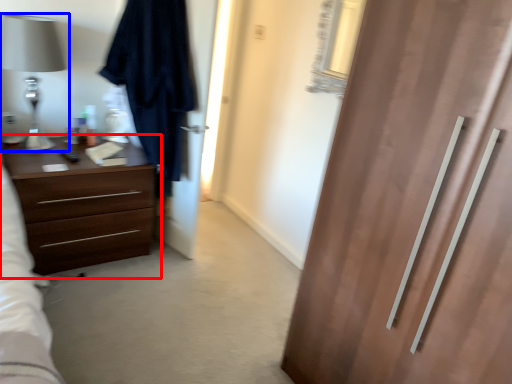
Question: Which of the following is the farthest to the observer, chest of drawers (highlighted by a red box) or table lamp (highlighted by a blue box)?

Choices:
 (A) chest of drawers
 (B) table lamp

Answer: (A)